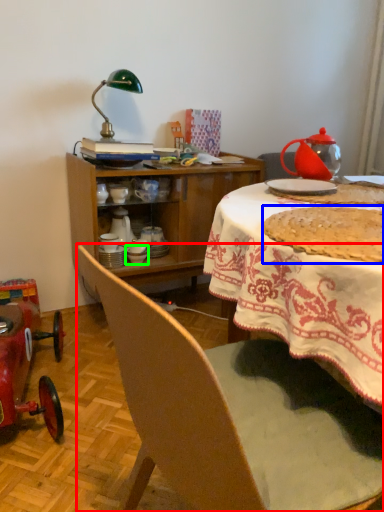
Question: Which object is positioned farthest from chair (highlighted by a red box)? Select from food (highlighted by a blue box) and tableware (highlighted by a green box).

Choices:
 (A) food
 (B) tableware

Answer: (B)